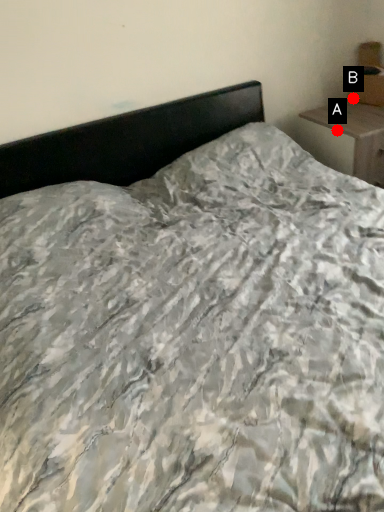
Question: Two points are circled on the image, labeled by A and B beside each circle. Which point appears farthest from the camera in this image?

Choices:
 (A) A is further
 (B) B is further

Answer: (B)